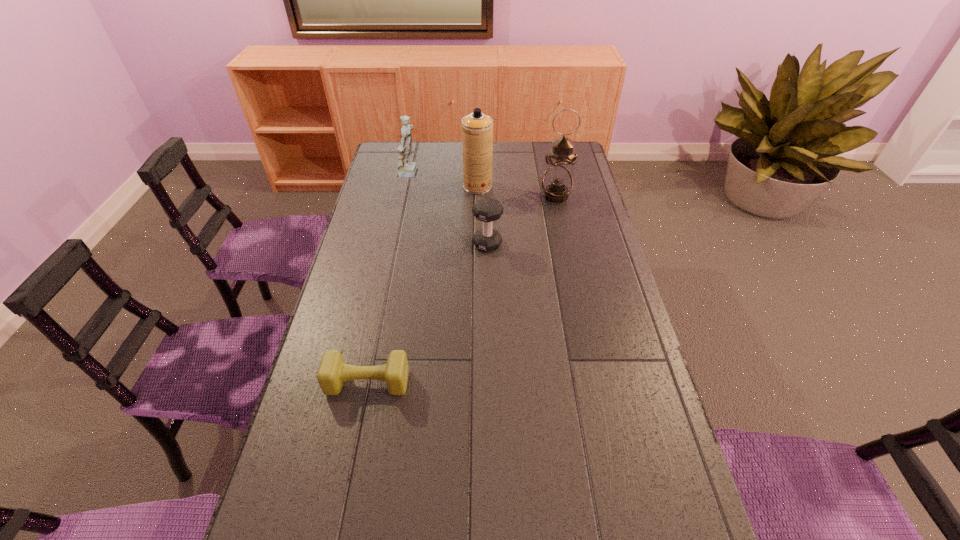
In order to click on the rightmost object in this screenshot , I will do `click(557, 182)`.

What are the coordinates of `aerosol can` in the screenshot? It's located at (477, 128).

I want to click on the third shortest object, so click(x=406, y=168).

You are a GUI agent. You are given a task and a screenshot of the screen. Output one action in this format:
    pyautogui.click(x=<x>, y=<y>)
    Task: Click on the farther dumbbell
    
    Given the screenshot: What is the action you would take?
    pyautogui.click(x=487, y=210)

The image size is (960, 540). In order to click on the second shortest object in this screenshot , I will do `click(487, 210)`.

Identify the location of the nearest object. This screenshot has width=960, height=540. (333, 371).

Identify the location of the nearer dumbbell. (333, 371).

At what (x,y) coordinates should I click in order to perform the action: click on vacant space located 0.190m on the front of the oil lamp. Please return your answer as a coordinate pair (x, y). This screenshot has height=540, width=960. Looking at the image, I should click on (564, 236).

Identify the location of vacant space located on the back of the aerosol can. click(x=478, y=154).

Where is `vacant area situated on the front-facing side of the third tallest object`? The image size is (960, 540). vacant area situated on the front-facing side of the third tallest object is located at coordinates (470, 175).